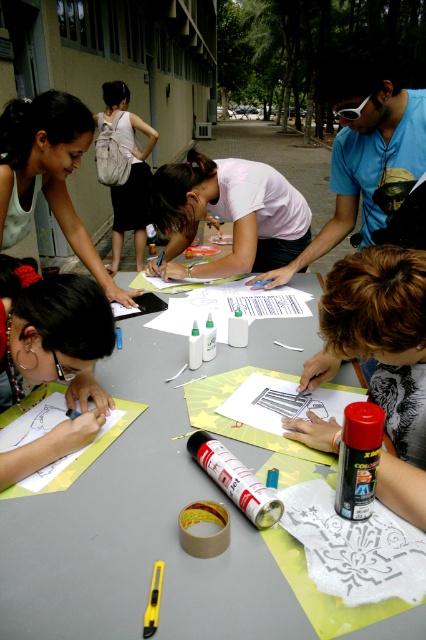
Identify the location of gray matte table at center. This screenshot has width=426, height=640. (137, 532).

Based on the photo, is the position of blue cotton shirt at upper right less distant than that of white matte shirt at center?

Yes, it is in front of white matte shirt at center.

What do you see at coordinates (365, 147) in the screenshot?
I see `blue cotton shirt at upper right` at bounding box center [365, 147].

You are a GUI agent. You are given a task and a screenshot of the screen. Output one action in this format:
    pyautogui.click(x=<x>, y=<y>)
    Task: Click on the blue cotton shirt at upper right
    
    Given the screenshot: What is the action you would take?
    pyautogui.click(x=365, y=147)

Identify the location of blue cotton shirt at upper right. The height and width of the screenshot is (640, 426). (365, 147).

Can you confirm if matte black hair at center is shorter than white matte shirt at center?

Yes, matte black hair at center is shorter than white matte shirt at center.

Is point (34, 300) closer to camera compared to point (247, 250)?

That is True.

Where is `matte black hair at center`? Image resolution: width=426 pixels, height=640 pixels. matte black hair at center is located at coordinates (52, 355).